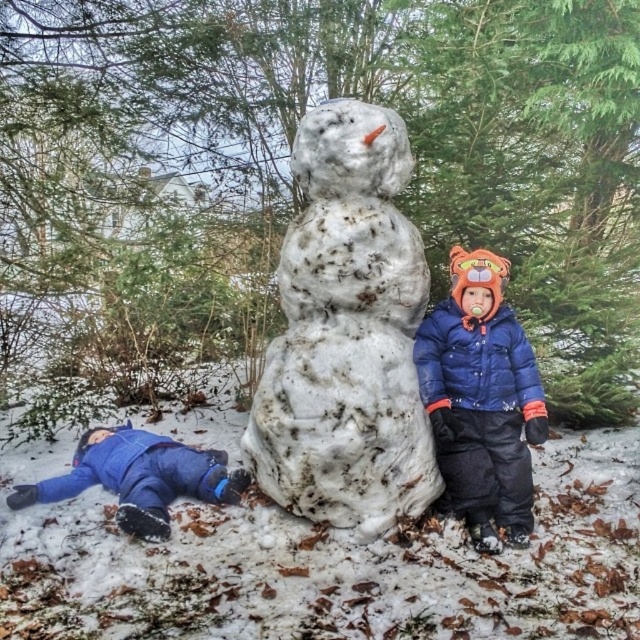
Which is above, blue down jacket at center or blue fleece jacket at lower left?

Positioned higher is blue down jacket at center.

Is the position of blue down jacket at center less distant than that of blue fleece jacket at lower left?

No, it is behind blue fleece jacket at lower left.

This screenshot has height=640, width=640. In order to click on blue down jacket at center in this screenshot , I will do `click(481, 400)`.

Between white textured snowman at center and blue fleece jacket at lower left, which one is positioned lower?

blue fleece jacket at lower left is below.

Can you confirm if white textured snowman at center is positioned to the left of blue fleece jacket at lower left?

In fact, white textured snowman at center is to the right of blue fleece jacket at lower left.

What do you see at coordinates (346, 333) in the screenshot? I see `white textured snowman at center` at bounding box center [346, 333].

Locate an element on the screen. white textured snowman at center is located at coordinates (346, 333).

Does white textured snowman at center appear under blue down jacket at center?

No.

Can you confirm if white textured snowman at center is positioned to the right of blue down jacket at center?

Incorrect, white textured snowman at center is not on the right side of blue down jacket at center.

Is point (324, 122) less distant than point (477, 348)?

Yes, it is in front of point (477, 348).

Find the location of `white textured snowman at center`. white textured snowman at center is located at coordinates (346, 333).